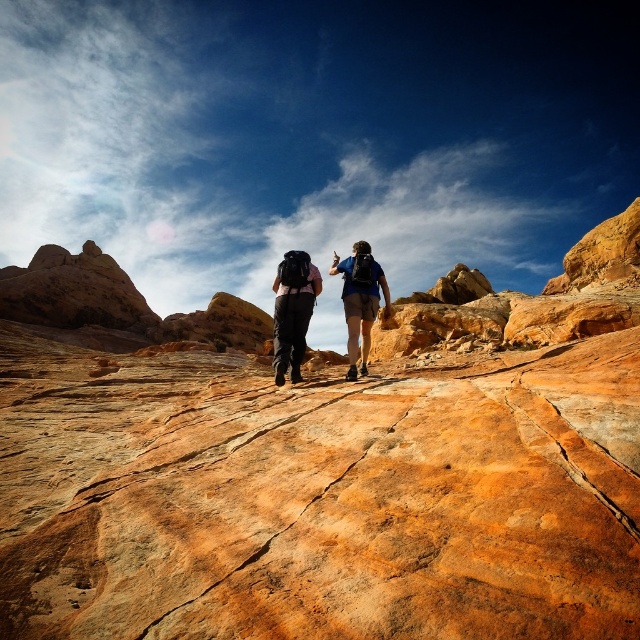
Which is more to the left, matte black backpacks at center or matte blue backpack at center?

From the viewer's perspective, matte black backpacks at center appears more on the left side.

The height and width of the screenshot is (640, 640). Identify the location of matte black backpacks at center. (360, 300).

Where is `matte black backpacks at center`? matte black backpacks at center is located at coordinates (360, 300).

Can you confirm if matte black backpack at center is positioned to the right of matte blue backpack at center?

In fact, matte black backpack at center is to the left of matte blue backpack at center.

Who is positioned more to the right, matte black backpack at center or matte blue backpack at center?

Positioned to the right is matte blue backpack at center.

Is point (276, 330) closer to camera compared to point (333, 268)?

Yes.

In order to click on matte black backpack at center in this screenshot , I will do `click(292, 310)`.

Can you confirm if matte black backpacks at center is positioned below matte black backpack at center?

Incorrect, matte black backpacks at center is not positioned below matte black backpack at center.

Is matte black backpacks at center thinner than matte black backpack at center?

No, matte black backpacks at center is not thinner than matte black backpack at center.

Which is in front, point (356, 243) or point (280, 362)?

Point (280, 362) is in front.

This screenshot has height=640, width=640. In order to click on matte black backpacks at center in this screenshot , I will do `click(360, 300)`.